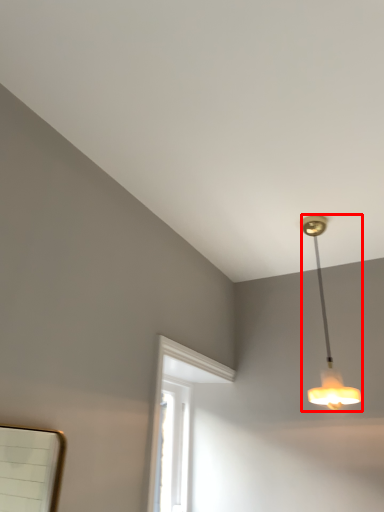
Question: From the image's perspective, considering the relative positions of lamp (annotated by the red box) and window in the image provided, where is lamp (annotated by the red box) located with respect to the staircase?

Choices:
 (A) below
 (B) above

Answer: (B)